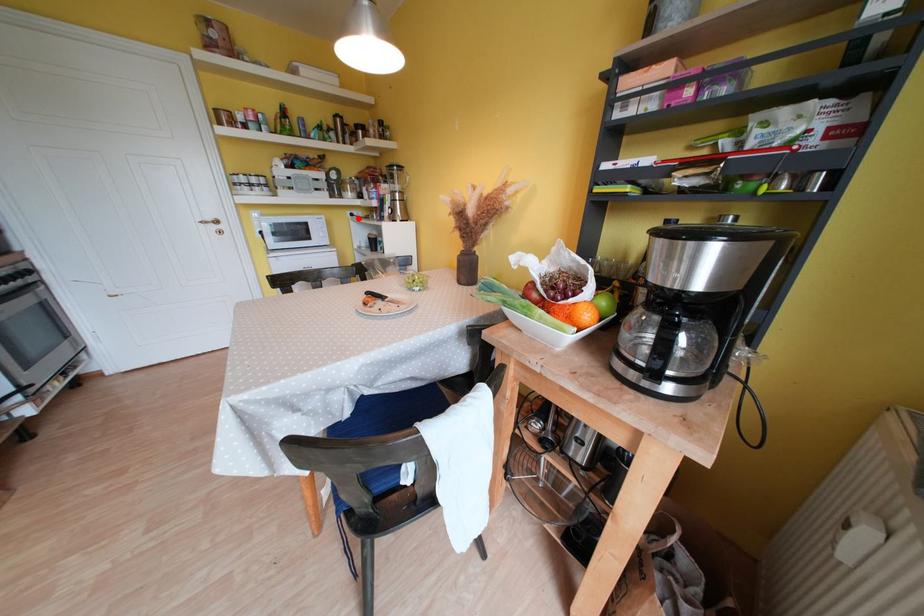
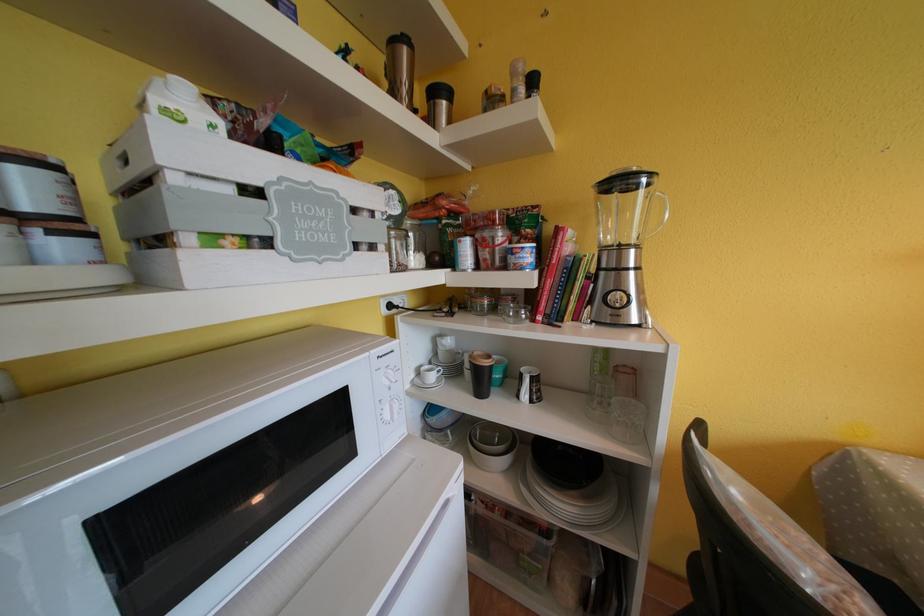
Question: I am providing you with two images of the same scene from different viewpoints. In image1, a red point is highlighted. Considering the same 3D point in image2, which of the following is correct?

Choices:
 (A) It is closer
 (B) It is farther

Answer: (B)